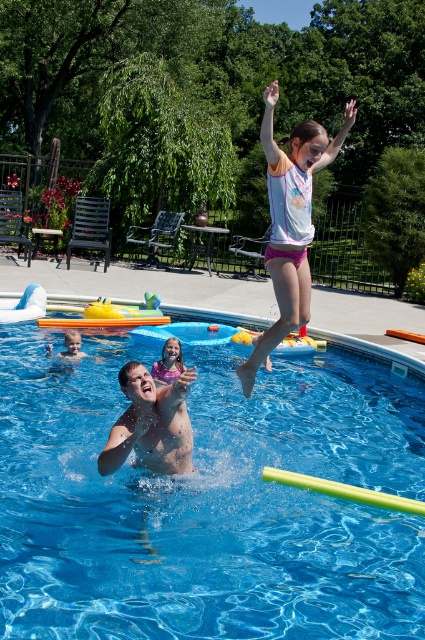
Question: In this image, where is blue smooth water at center located relative to matte pink shorts at upper center?

Choices:
 (A) below
 (B) above

Answer: (A)

Question: Among these objects, which one is farthest from the camera?

Choices:
 (A) smooth tan skin at center
 (B) pink fabric shorts at upper center
 (C) blue smooth water at center
 (D) smooth skin man at center

Answer: (A)

Question: Which object is positioned farthest from the pink fabric shorts at upper center?

Choices:
 (A) matte pink shorts at upper center
 (B) smooth tan skin at center

Answer: (B)

Question: Is pink fabric shorts at upper center thinner than matte pink shorts at upper center?

Choices:
 (A) yes
 (B) no

Answer: (A)

Question: Which object appears farthest from the camera in this image?

Choices:
 (A) smooth tan skin at center
 (B) matte pink shorts at upper center
 (C) blue smooth water at center
 (D) smooth skin man at center

Answer: (A)

Question: Is pink fabric shorts at upper center bigger than smooth tan skin at center?

Choices:
 (A) no
 (B) yes

Answer: (A)